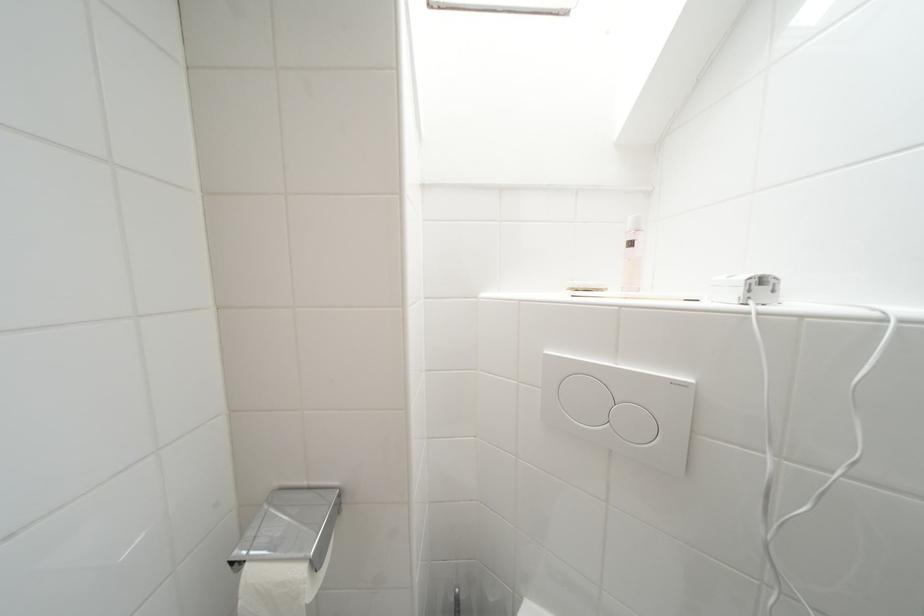
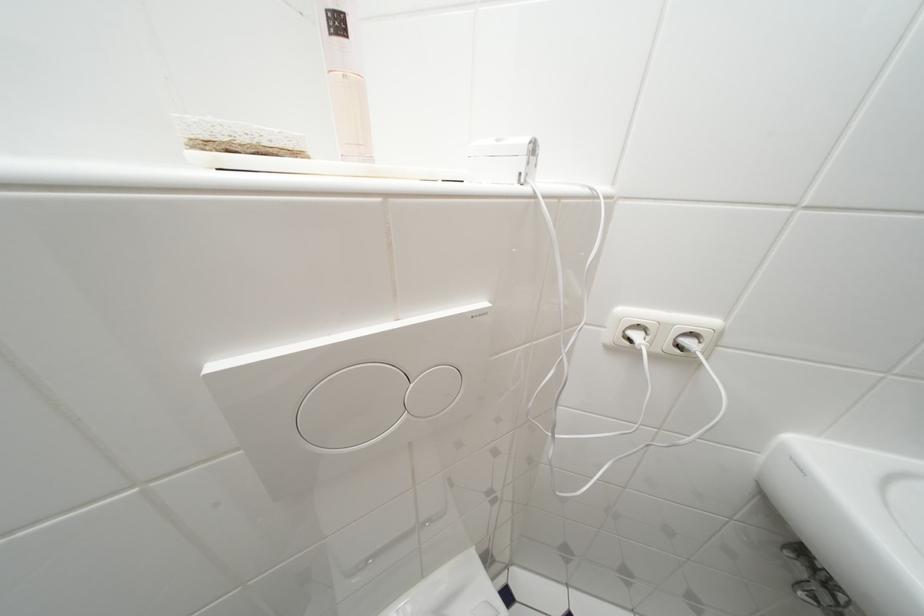
How did the camera likely rotate?

The rotation direction of the camera is right-down.